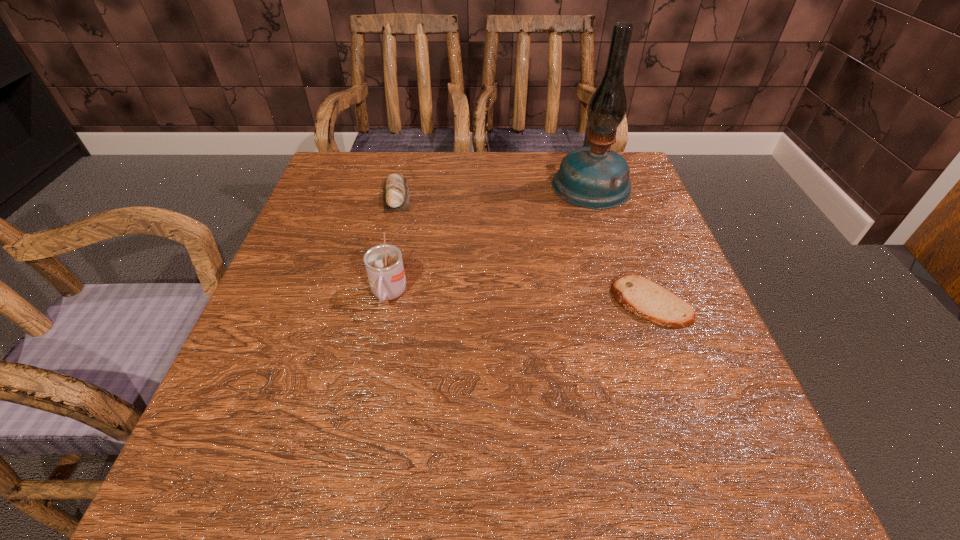
Image resolution: width=960 pixels, height=540 pixels. In order to click on the tallest object in this screenshot , I will do `click(594, 177)`.

In order to click on the second tallest object in this screenshot , I will do `click(384, 265)`.

Find the location of `the third tallest object`. the third tallest object is located at coordinates (395, 189).

I want to click on the left pita bread, so click(x=395, y=189).

At what (x,y) coordinates should I click in order to perform the action: click on the shorter pita bread. Please return your answer as a coordinate pair (x, y). The height and width of the screenshot is (540, 960). Looking at the image, I should click on (643, 298).

Where is `the nearer pita bread`? This screenshot has width=960, height=540. the nearer pita bread is located at coordinates (643, 298).

The width and height of the screenshot is (960, 540). In order to click on blank space located on the left of the tallest object in this screenshot , I will do `click(518, 185)`.

Where is `free region located on the side with the handle of the second tallest object`? Image resolution: width=960 pixels, height=540 pixels. free region located on the side with the handle of the second tallest object is located at coordinates (380, 339).

Image resolution: width=960 pixels, height=540 pixels. I want to click on vacant region located on the right of the farther pita bread, so click(x=563, y=194).

You are a GUI agent. You are given a task and a screenshot of the screen. Output one action in this format:
    pyautogui.click(x=<x>, y=<y>)
    Task: Click on the free location located on the left of the shortest object
    The image size is (960, 540).
    Given the screenshot: What is the action you would take?
    (541, 303)